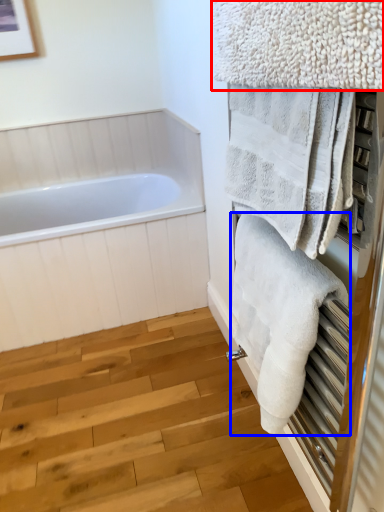
Question: Which point is closer to the camera, towel (highlighted by a red box) or towel (highlighted by a blue box)?

Choices:
 (A) towel
 (B) towel

Answer: (A)